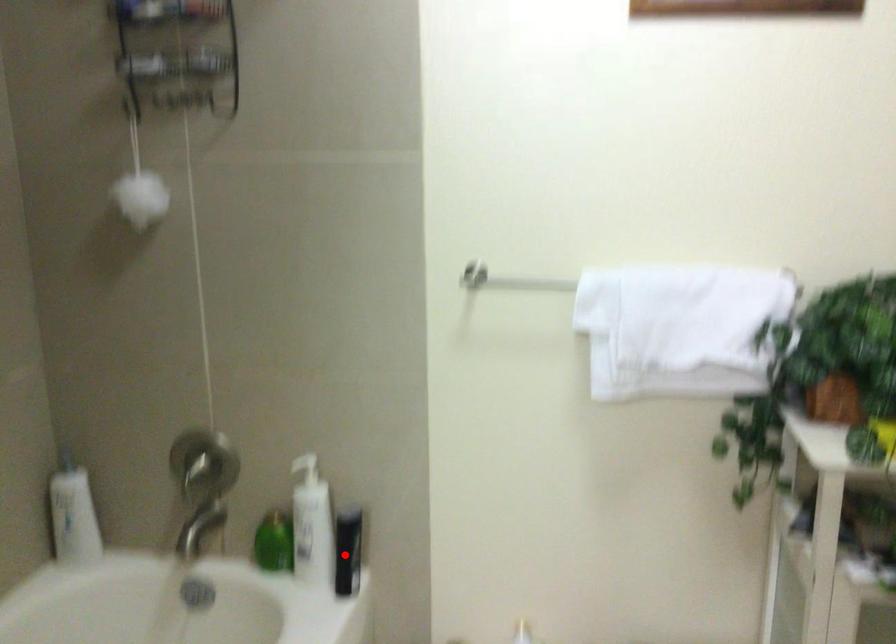
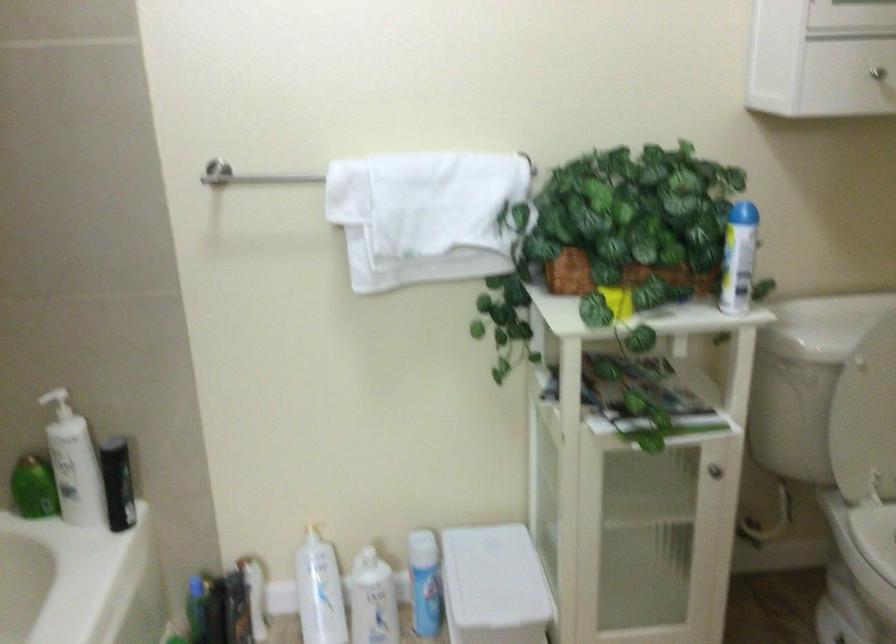
Locate, in the second image, the point that corresponds to the highlighted location in the first image.

(117, 483)